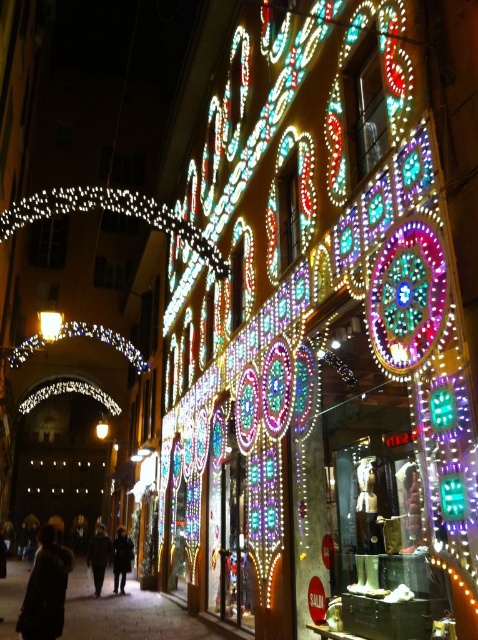
In the scene shown: Measure the distance from dark wool coat at lower left to dark gray coat at lower left.

dark wool coat at lower left is 15.54 meters from dark gray coat at lower left.

Can you confirm if dark wool coat at lower left is bigger than dark gray coat at lower left?

Indeed, dark wool coat at lower left has a larger size compared to dark gray coat at lower left.

Does point (37, 627) come behind point (95, 556)?

No, (37, 627) is in front of (95, 556).

In order to click on dark wool coat at lower left in this screenshot , I will do coord(45,589).

Is dark wool coat at lower left positioned at the back of dark brown coat at center?

No, dark wool coat at lower left is closer to the viewer.

From the picture: How far apart are dark wool coat at lower left and dark brown coat at center?

dark wool coat at lower left is 15.55 meters from dark brown coat at center.

What are the coordinates of `dark wool coat at lower left` in the screenshot? It's located at (45, 589).

Which is below, dark gray coat at lower left or dark brown coat at center?

Positioned lower is dark gray coat at lower left.

Which of these two, dark gray coat at lower left or dark brown coat at center, stands shorter?

dark brown coat at center

Where is `dark gray coat at lower left`? This screenshot has height=640, width=478. dark gray coat at lower left is located at coordinates [x=98, y=556].